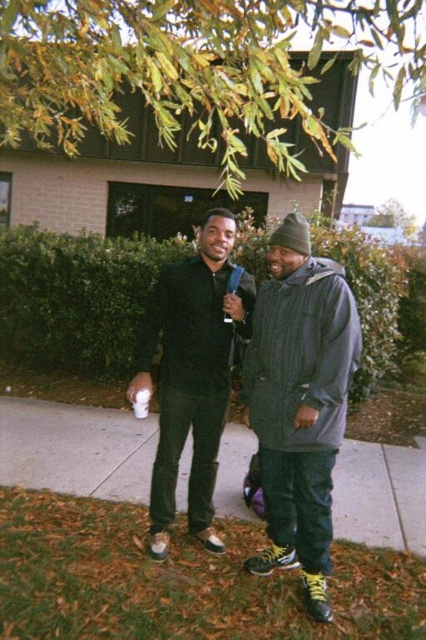
Can you confirm if matte black pants at lower center is taller than matte black shirt at center?

In fact, matte black pants at lower center may be shorter than matte black shirt at center.

Who is more forward, [232,435] or [207,355]?

Positioned in front is point [207,355].

Find the location of a particular element. Image resolution: width=426 pixels, height=640 pixels. matte black pants at lower center is located at coordinates (75, 449).

Is green leafy tree at upper center thinner than matte black shirt at center?

In fact, green leafy tree at upper center might be wider than matte black shirt at center.

Which is in front, point (51, 90) or point (178, 396)?

Point (178, 396) is more forward.

Between point (238, 180) and point (213, 387), which one is positioned in front?

Positioned in front is point (213, 387).

Where is `green leafy tree at upper center`? Image resolution: width=426 pixels, height=640 pixels. green leafy tree at upper center is located at coordinates (193, 68).

Between point (345, 36) and point (279, 305), which one is positioned behind?

Point (279, 305)

Who is more forward, (x=36, y=67) or (x=325, y=355)?

Positioned in front is point (x=325, y=355).

Where is `green leafy tree at upper center`? The height and width of the screenshot is (640, 426). green leafy tree at upper center is located at coordinates (193, 68).